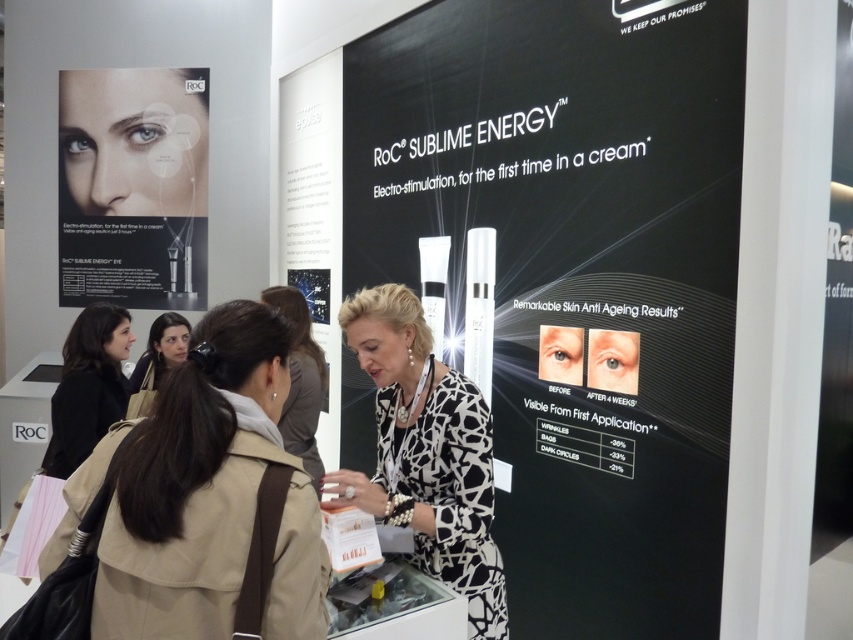
Question: Which point is closer to the camera taking this photo?

Choices:
 (A) (144, 362)
 (B) (160, 236)
 (C) (71, 348)
 (D) (383, 365)

Answer: (D)

Question: Which of the following is the farthest from the observer?

Choices:
 (A) black printed dress at center
 (B) white glossy poster at center
 (C) tan leather jacket at lower left

Answer: (B)

Question: Observing the image, what is the correct spatial positioning of matte black eye cream at upper left in reference to black printed dress at center?

Choices:
 (A) right
 (B) left

Answer: (B)

Question: Which point is closer to the camera?

Choices:
 (A) white glossy poster at center
 (B) tan leather jacket at lower left
 (C) black printed dress at center
 (D) matte black eye cream at upper left

Answer: (B)

Question: Is matte black eye cream at upper left wider than black matte jacket at lower left?

Choices:
 (A) yes
 (B) no

Answer: (A)

Question: Does black matte jacket at lower left appear under brown leather jacket at center?

Choices:
 (A) no
 (B) yes

Answer: (B)